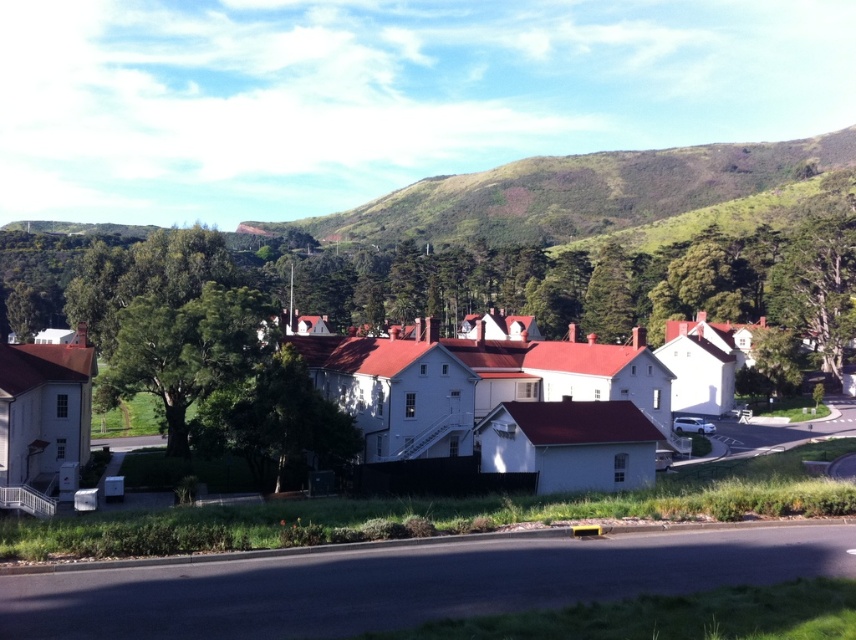
Which is more to the right, green grassy hillside at upper center or green leafy tree at center-left?

green grassy hillside at upper center

Between green grassy hillside at upper center and green leafy tree at center-left, which one has more height?

green grassy hillside at upper center is taller.

Who is more forward, (x=682, y=184) or (x=128, y=326)?

Point (x=128, y=326) is more forward.

Identify the location of green grassy hillside at upper center. The width and height of the screenshot is (856, 640). (575, 193).

Is green grassy hillside at upper center wider than green leafy tree at center?

Yes.

The width and height of the screenshot is (856, 640). What do you see at coordinates (575, 193) in the screenshot?
I see `green grassy hillside at upper center` at bounding box center [575, 193].

Between point (538, 157) and point (270, 394), which one is positioned behind?

The point (538, 157) is behind.

I want to click on green grassy hillside at upper center, so click(575, 193).

Does green leafy tree at center have a larger size compared to green textured tree at right?

Actually, green leafy tree at center might be smaller than green textured tree at right.

Which is in front, point (278, 403) or point (843, 236)?

Positioned in front is point (278, 403).

Image resolution: width=856 pixels, height=640 pixels. What are the coordinates of `green leafy tree at center` in the screenshot? It's located at (274, 420).